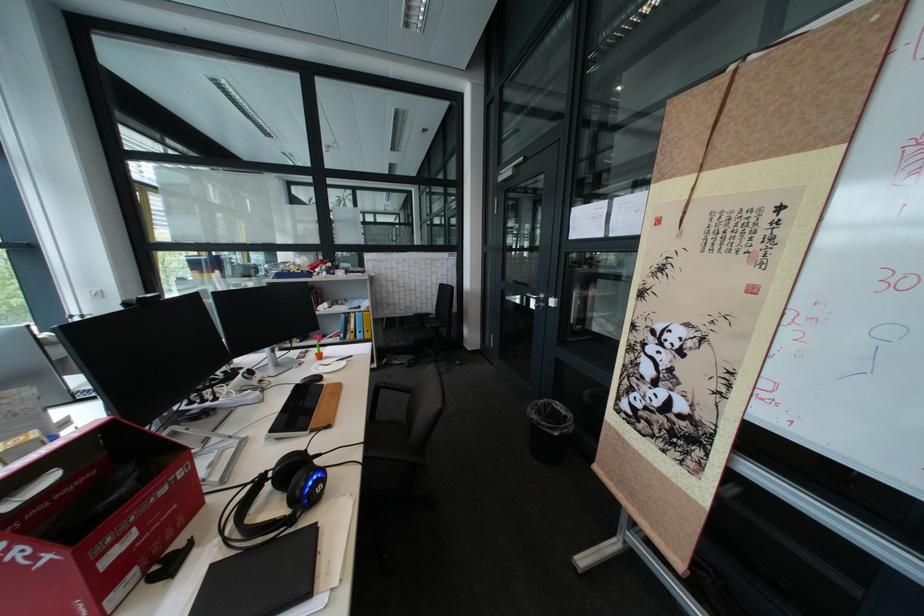
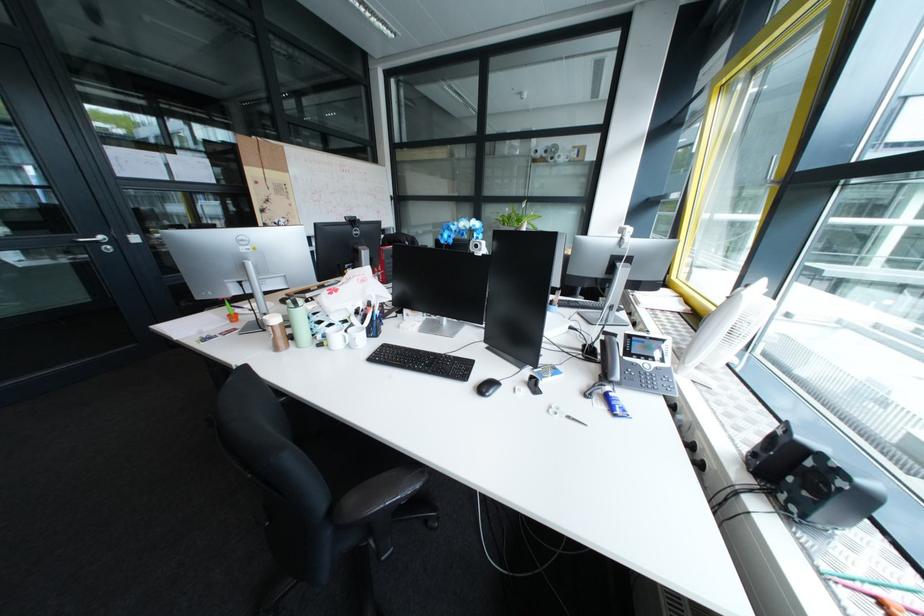
Question: I am providing you with two images of the same scene from different viewpoints. Which of the following objects are not visible in image2?

Choices:
 (A) white computer mouse
 (B) white desk fan
 (C) fridge door
 (D) white mug handle

Answer: (A)